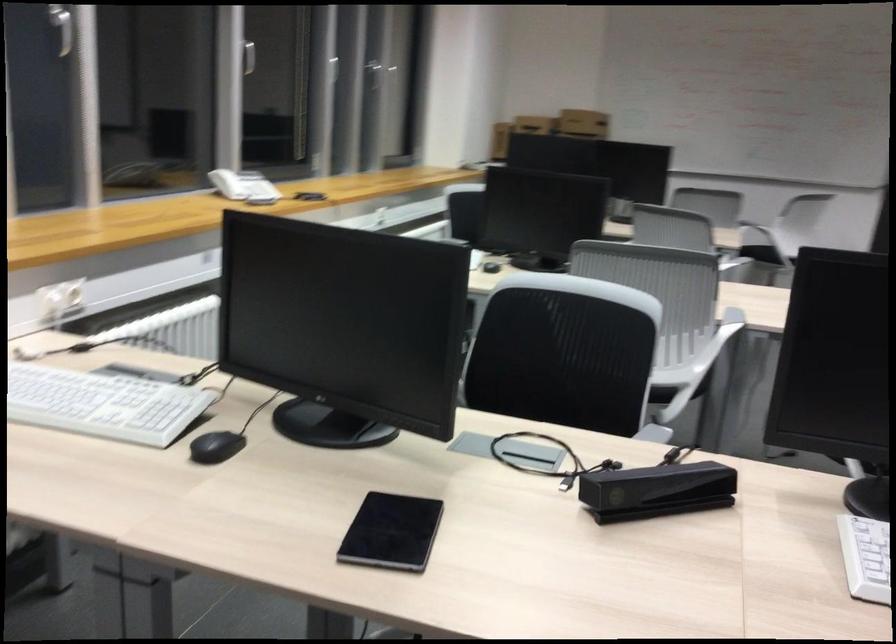
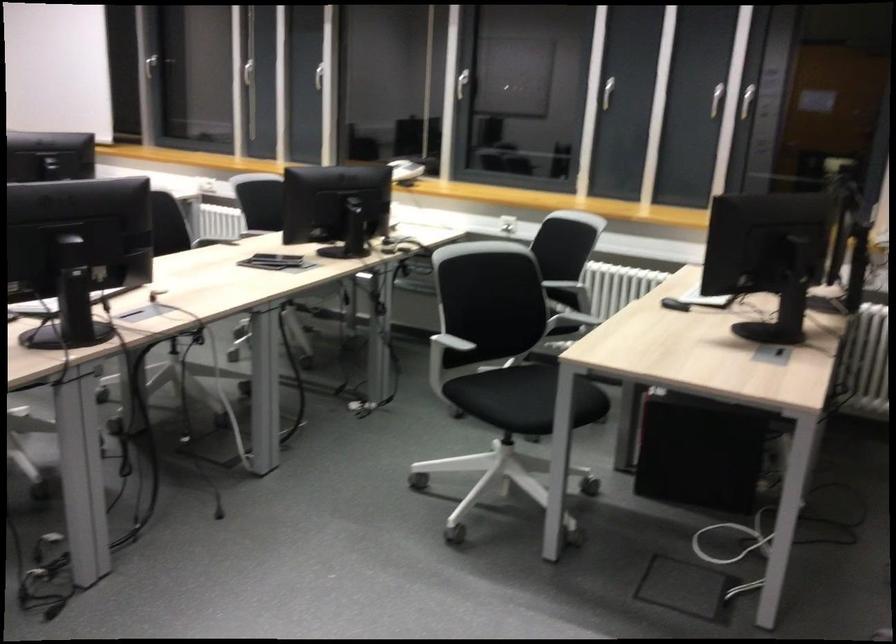
Question: I am providing you with two images of the same scene from different viewpoints. After the viewpoint changes to image2, which objects are now occluded?

Choices:
 (A) phone handset
 (B) chair sitting surface
 (C) computer mouse
 (D) black kit latch

Answer: (B)